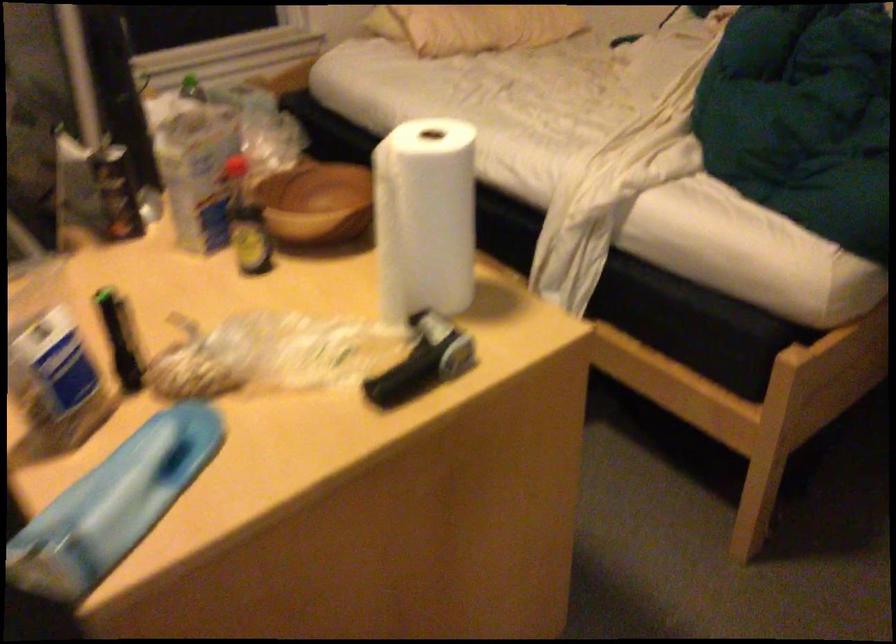
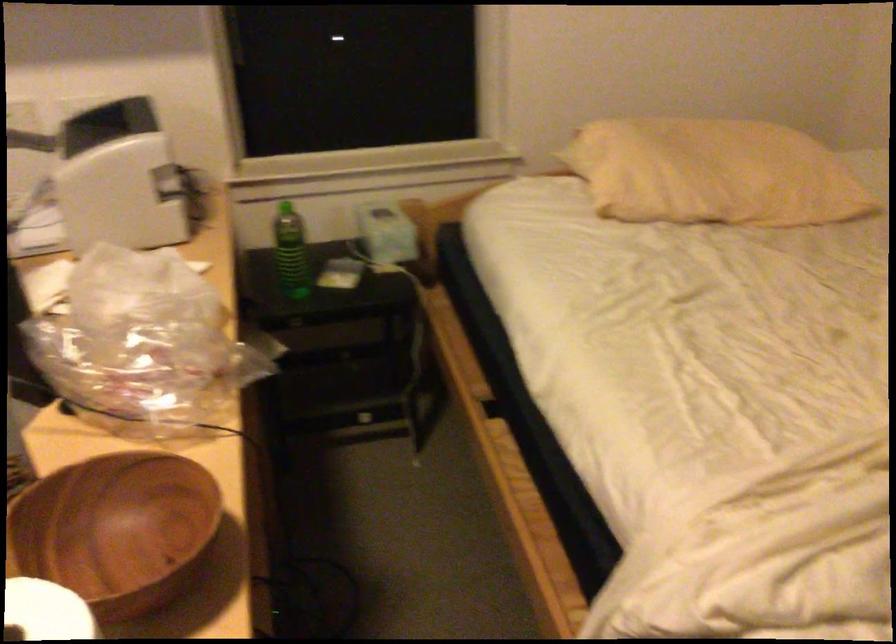
Question: How did the camera likely rotate?

Choices:
 (A) Left
 (B) Right
 (C) Up
 (D) Down

Answer: (A)